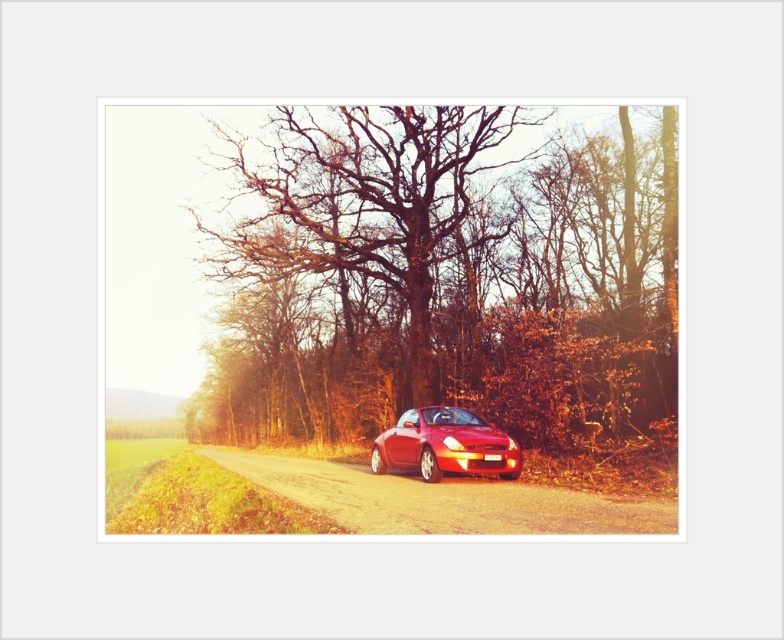
Question: Estimate the real-world distances between objects in this image. Which object is farther from the bare branches at center?

Choices:
 (A) smooth asphalt road at center
 (B) glossy red car at center

Answer: (B)

Question: Does smooth asphalt road at center have a larger size compared to glossy red car at center?

Choices:
 (A) no
 (B) yes

Answer: (B)

Question: Can you confirm if bare branches at center is positioned to the right of glossy red car at center?

Choices:
 (A) no
 (B) yes

Answer: (A)

Question: Does bare branches at center have a greater width compared to smooth asphalt road at center?

Choices:
 (A) no
 (B) yes

Answer: (B)

Question: Based on their relative distances, which object is nearer to the bare branches at center?

Choices:
 (A) glossy red car at center
 (B) smooth asphalt road at center

Answer: (B)

Question: Based on their relative distances, which object is farther from the bare branches at center?

Choices:
 (A) smooth asphalt road at center
 (B) glossy red car at center

Answer: (B)